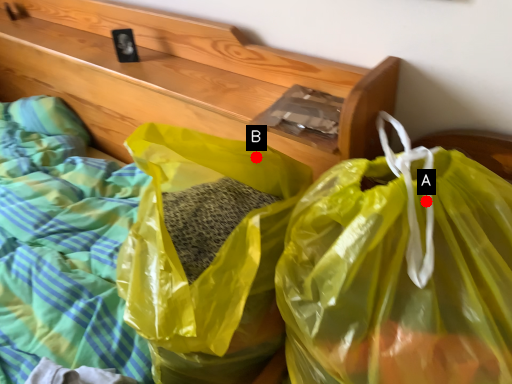
Question: Two points are circled on the image, labeled by A and B beside each circle. Among these points, which one is nearest to the camera?

Choices:
 (A) A is closer
 (B) B is closer

Answer: (A)